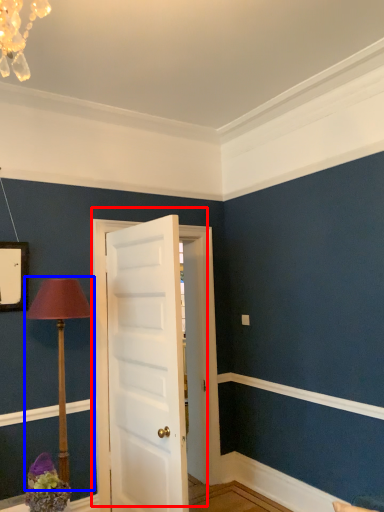
Question: Which object is closer to the camera taking this photo, door (highlighted by a red box) or table lamp (highlighted by a blue box)?

Choices:
 (A) door
 (B) table lamp

Answer: (B)